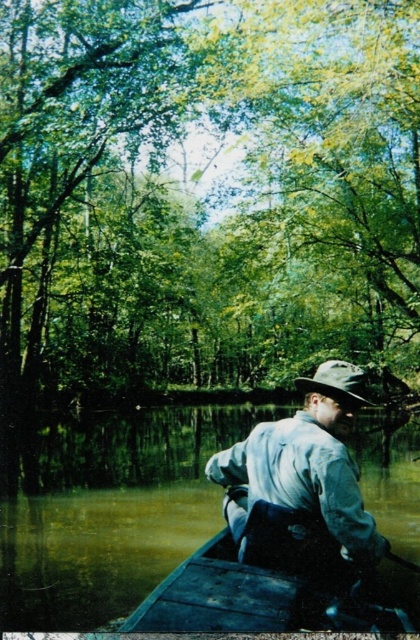
Question: Can you confirm if dark brown wooden canoe at lower center is positioned above brown fabric hat at center?

Choices:
 (A) yes
 (B) no

Answer: (B)

Question: Which of the following is the farthest from the observer?

Choices:
 (A) (63, 260)
 (B) (327, 522)
 (C) (2, 490)

Answer: (A)

Question: Which point is closer to the camera taking this photo?

Choices:
 (A) [x=218, y=566]
 (B) [x=193, y=448]
 (C) [x=233, y=256]

Answer: (A)

Question: Which point appears closest to the camera in this image?

Choices:
 (A) (92, 518)
 (B) (340, 387)
 (C) (217, 589)

Answer: (C)

Question: Is greenish-brown wood at lower right positioned before light blue denim shirt at center?

Choices:
 (A) no
 (B) yes

Answer: (A)

Question: Can you confirm if green leafy trees at upper center is smaller than greenish-brown wood at lower right?

Choices:
 (A) no
 (B) yes

Answer: (A)